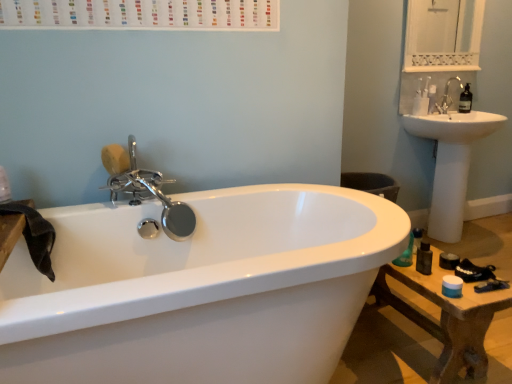
Question: From the image's perspective, is white glossy medicine cabinet at upper right above or below white matte toilet paper at upper right?

Choices:
 (A) below
 (B) above

Answer: (B)

Question: From a real-world perspective, relative to white matte toilet paper at upper right, is white glossy medicine cabinet at upper right vertically above or below?

Choices:
 (A) above
 (B) below

Answer: (A)

Question: Based on their relative distances, which object is nearer to the wooden table at lower right?

Choices:
 (A) white glossy medicine cabinet at upper right
 (B) yellow sponge at upper left
 (C) polished chrome faucet at upper left, the second tap from the top
 (D) white glossy sink at upper right
 (E) white matte toilet paper at upper right

Answer: (C)

Question: Considering the real-world distances, which object is farthest from the clear plastic bottle at upper right?

Choices:
 (A) white matte toilet paper at upper right
 (B) yellow sponge at upper left
 (C) polished chrome faucet at upper left, arranged as the first tap when viewed from the front
 (D) satin nickel faucet at upper right, marked as the 1th tap in a back-to-front arrangement
 (E) white glossy medicine cabinet at upper right

Answer: (B)